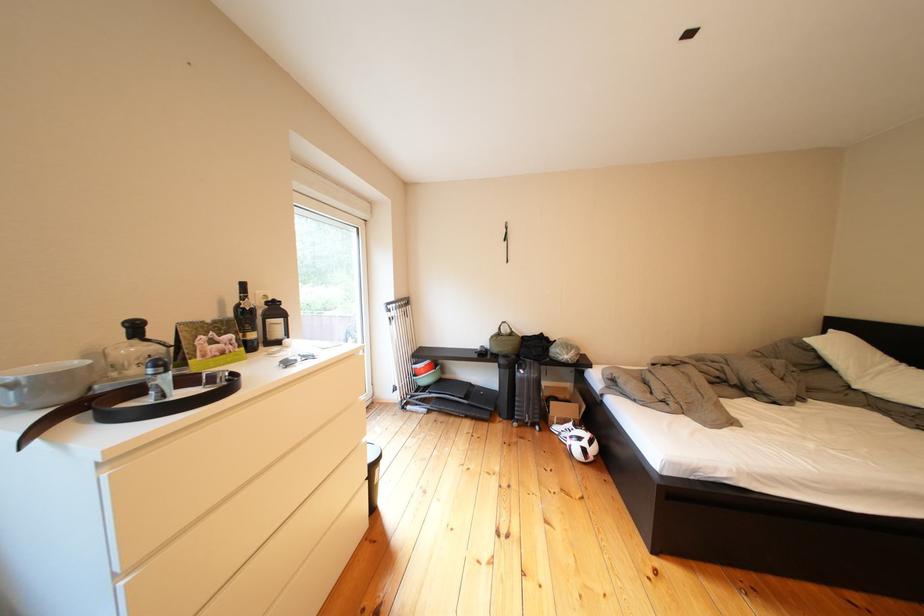
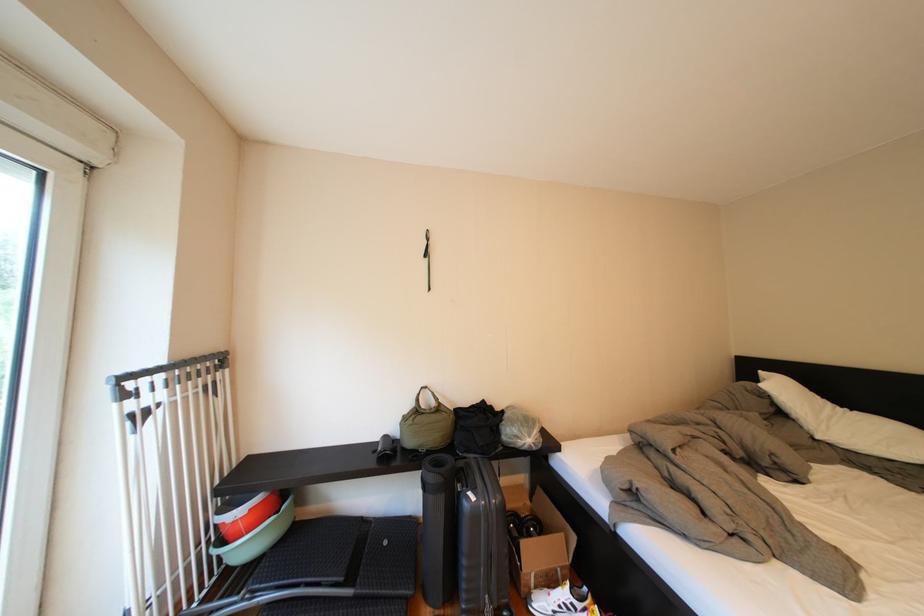
Where in the second image is the point corresponding to point (419, 307) from the first image?

(224, 369)